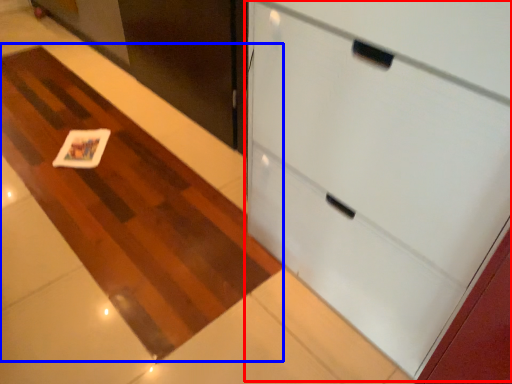
Question: Among these objects, which one is nearest to the camera, cabinetry (highlighted by a red box) or plain (highlighted by a blue box)?

Choices:
 (A) cabinetry
 (B) plain

Answer: (A)